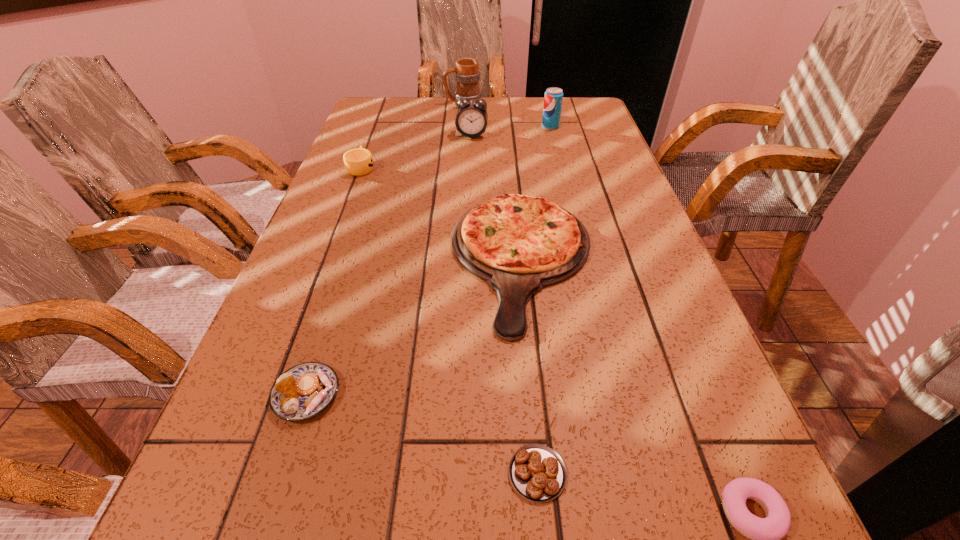
This screenshot has height=540, width=960. Identify the location of free area in between the fourth farthest object and the third shortest object. (334, 281).

Image resolution: width=960 pixels, height=540 pixels. Find the location of `vacant region between the cup and the shortest pastry`. vacant region between the cup and the shortest pastry is located at coordinates (449, 321).

Find the location of `the fourth closest object to the farthest object`. the fourth closest object to the farthest object is located at coordinates (518, 244).

Find the location of `object that can be found as the seventh closest to the seventh nearest object`. object that can be found as the seventh closest to the seventh nearest object is located at coordinates (765, 533).

Locate which pastry ranks second in proximity to the farthest pastry. Please provide its 2D coordinates. Your answer should be formatted as a tuple, i.e. [(x, y)], where the tuple contains the x and y coordinates of a point satisfying the conditions above.

[(765, 533)]

You are a GUI agent. You are given a task and a screenshot of the screen. Output one action in this format:
    pyautogui.click(x=<x>, y=<y>)
    Task: Click on the pastry that is the closest to the second pastry from left to right
    This screenshot has height=540, width=960.
    Given the screenshot: What is the action you would take?
    pyautogui.click(x=765, y=533)

Where is `free space that satisfies the following two spatial constraints: 1. on the side of the second pastry from right to left with the handle; 2. on the left side of the farthest object`? free space that satisfies the following two spatial constraints: 1. on the side of the second pastry from right to left with the handle; 2. on the left side of the farthest object is located at coordinates (438, 473).